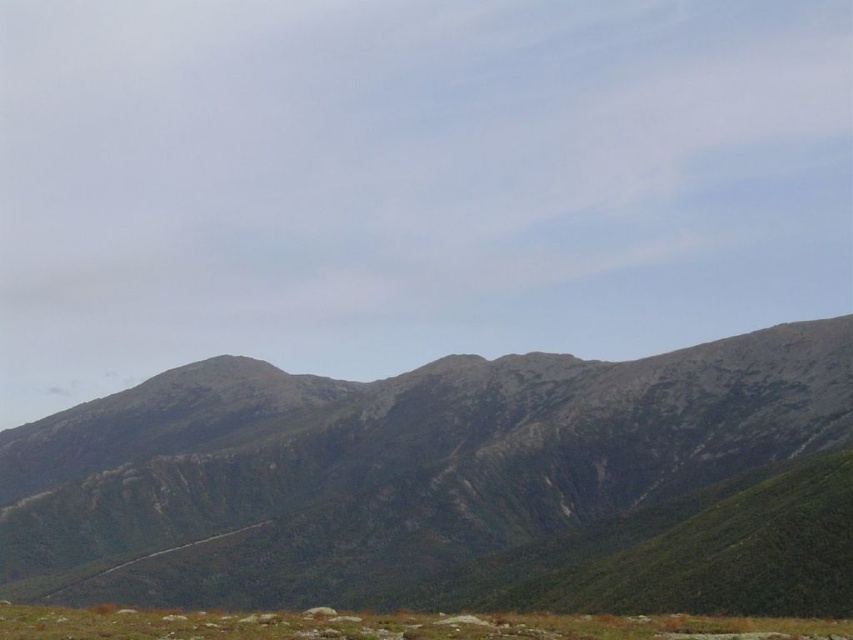
You are a hiker planning to cross the rugged gray rock at center and the green grassy at lower center. Which path is wider for easier passage?

The rugged gray rock at center is wider than the green grassy at lower center, so the path through the rugged gray rock at center would be wider and easier to pass through.

You are a hiker trying to navigate through the mountainous landscape. You need to reach a rugged gray rock at center. According to the map, you are currently at point (387, 465). Is the rugged gray rock at center located to your north or south?

The rugged gray rock at center is located at point (387, 465), which is your current position. Therefore, you are already at the rugged gray rock at center.

You are a hiker planning to cross the rugged gray rock at center and the green grassy at lower center. Which terrain should you avoid if you want to prevent slipping?

You should avoid the green grassy at lower center because the rugged gray rock at center is positioned under it, making the grassy area potentially unstable or slippery.